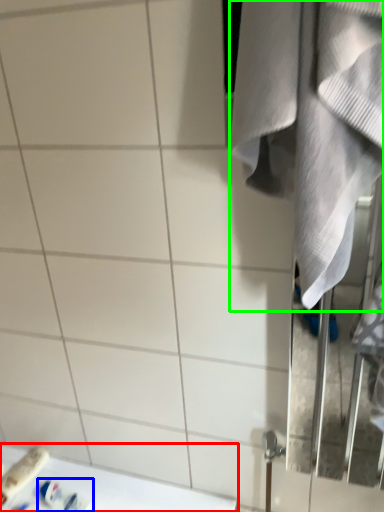
Question: Which object is positioned farthest from counter top (highlighted by a red box)? Select from toiletry (highlighted by a blue box) and towel (highlighted by a green box).

Choices:
 (A) toiletry
 (B) towel

Answer: (B)